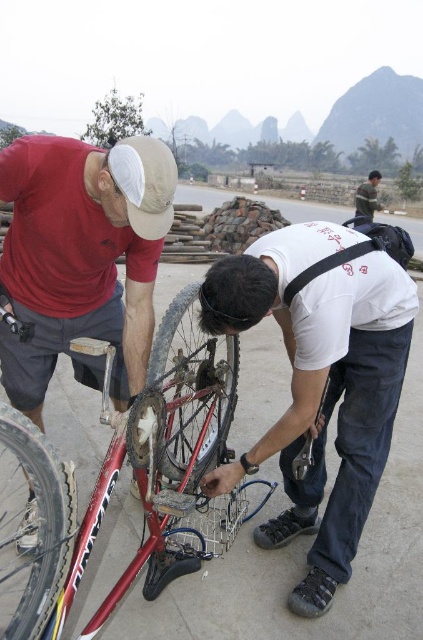
You are standing in a rural area with a road and mountains in the background. You see a matte red bicycle at left. If you want to reach the bicycle quickly, how many steps would you estimate you need to take?

The matte red bicycle at left is 6.57 feet from viewer. Assuming an average step length of about 2.5 feet, you would need approximately 3 steps to reach the bicycle.

You are a photographer trying to capture both the shiny metallic bicycle at center and the green striped sweater at upper right in a single frame. Since the camera has a limited focus area, you need to know which object is smaller to ensure both fit. Based on the scene description, which object is smaller?

The shiny metallic bicycle at center is smaller than the green striped sweater at upper right, so it occupies less space in the frame.

You are a delivery person who needs to place a 7 feet long ladder between the matte red bicycle at left and the green striped sweater at upper right. Can you fit the ladder horizontally between them without bending it?

The distance between the matte red bicycle at left and the green striped sweater at upper right is 6.99 feet, which is slightly shorter than the ladder. Therefore, the ladder cannot fit horizontally between them without bending it.